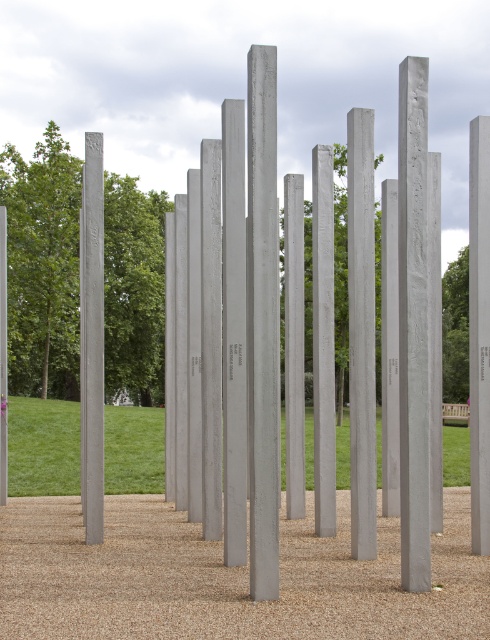
You are standing in the park and see the satin silver pole at right and the satin gray pole at center. Which pole is positioned higher relative to the other?

The satin silver pole at right is located above the satin gray pole at center, so it is positioned higher.

You are standing at the origin point of the coordinate system in the park. You want to place a new decorative stone at the same location as the sanded concrete pillar at center. What are the coordinates where you should place the new stone?

The coordinates for the sanded concrete pillar at center are at point (362, 332), so you should place the new decorative stone at those coordinates.

You are an architect designing a new park installation. You need to place a decorative statue that requires a base at least 2 meters tall. Given the sanded concrete pillar at center and the satin gray pole at center, which one can support the statue?

The satin gray pole at center is taller than the sanded concrete pillar at center, so the statue should be placed on the satin gray pole at center to meet the height requirement.